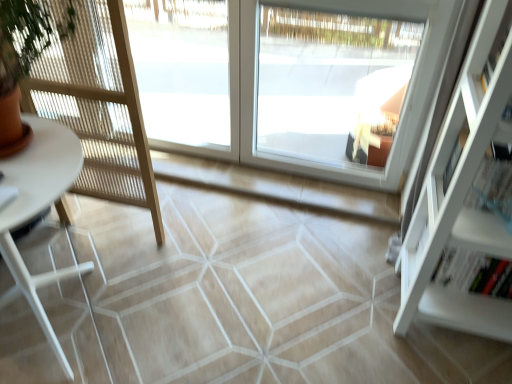
Image resolution: width=512 pixels, height=384 pixels. Identify the location of transparent glass window at center, which appears as the 3th window when viewed from the right. (183, 71).

Measure the distance between transparent glass window at center, the 1th window in the right-to-left sequence, and camera.

1.69 meters.

The width and height of the screenshot is (512, 384). Describe the element at coordinates (331, 88) in the screenshot. I see `transparent glass window at center, the 1th window in the right-to-left sequence` at that location.

Where is `transparent glass window at center, which appears as the 3th window when viewed from the right`? Image resolution: width=512 pixels, height=384 pixels. transparent glass window at center, which appears as the 3th window when viewed from the right is located at coordinates (183, 71).

Is white glass window at center, placed as the 2th window when sorted from right to left, positioned far away from white glossy table at left?

Indeed, white glass window at center, placed as the 2th window when sorted from right to left, is not near white glossy table at left.

Considering the relative positions of white glass window at center, positioned as the second window in left-to-right order, and white glossy table at left in the image provided, is white glass window at center, positioned as the second window in left-to-right order, to the right of white glossy table at left from the viewer's perspective?

Yes.

From a real-world perspective, is white glass window at center, placed as the 2th window when sorted from right to left, below white glossy table at left?

No.

Which of these two, white glass window at center, positioned as the second window in left-to-right order, or white glossy table at left, is bigger?

Bigger between the two is white glossy table at left.

From the image's perspective, which is below, white matte shelf at right or transparent glass window at center, the 1th window in the right-to-left sequence?

From the image's view, white matte shelf at right is below.

Identify the location of the 1st window to the left when counting from the white matte shelf at right. The width and height of the screenshot is (512, 384). (331, 88).

Is white matte shelf at right positioned beyond the bounds of transparent glass window at center, the 1th window in the right-to-left sequence?

white matte shelf at right lies outside transparent glass window at center, the 1th window in the right-to-left sequence,'s area.

Can you confirm if white matte shelf at right is smaller than transparent glass window at center, the 1th window in the right-to-left sequence?

Result: Actually, white matte shelf at right might be larger than transparent glass window at center, the 1th window in the right-to-left sequence.

From a real-world perspective, is transparent glass window at center, the 1th window in the right-to-left sequence, positioned above or below white glossy table at left?

Clearly, from a real-world perspective, transparent glass window at center, the 1th window in the right-to-left sequence, is above white glossy table at left.

Which object is thinner, transparent glass window at center, the 1th window in the right-to-left sequence, or white glossy table at left?

Thinner between the two is transparent glass window at center, the 1th window in the right-to-left sequence.

Is transparent glass window at center, the 1th window in the right-to-left sequence, aimed at white glossy table at left?

Yes, transparent glass window at center, the 1th window in the right-to-left sequence, faces towards white glossy table at left.

Which object is more forward, transparent glass window at center, placed as the 3th window when sorted from left to right, or white glossy table at left?

white glossy table at left.

Can you tell me how much transparent glass window at center, the 1th window in the right-to-left sequence, and transparent glass window at center, which appears as the 3th window when viewed from the right, differ in facing direction?

They differ by 0.000208 degrees in their facing directions.

Identify the location of the 2nd window directly beneath the transparent glass window at center, placed as the 3th window when sorted from left to right (from a real-world perspective). This screenshot has width=512, height=384. (183, 71).

Considering their positions, is transparent glass window at center, placed as the 3th window when sorted from left to right, located in front of or behind transparent glass window at center, placed as the 1th window when sorted from left to right?

transparent glass window at center, placed as the 3th window when sorted from left to right, is positioned closer to the viewer than transparent glass window at center, placed as the 1th window when sorted from left to right.

Considering the positions of point (306, 27) and point (233, 42), is point (306, 27) closer or farther from the camera than point (233, 42)?

Point (306, 27) appears to be farther away from the viewer than point (233, 42).

Are white matte shelf at right and white glossy table at left far apart?

Yes, white matte shelf at right is far from white glossy table at left.

Consider the image. Is white matte shelf at right oriented away from white glossy table at left?

No, white glossy table at left is not at the back of white matte shelf at right.

Between white matte shelf at right and white glossy table at left, which one has larger size?

Bigger between the two is white glossy table at left.

Which is closer to the camera, [443,128] or [0,236]?

The point [443,128] is closer to the camera.

From a real-world perspective, who is located higher, white glossy table at left or white matte shelf at right?

In real-world perspective, white matte shelf at right is above.

Is white glossy table at left next to white matte shelf at right and touching it?

No, white glossy table at left is not with white matte shelf at right.

From a real-world perspective, is white glass window at center, placed as the 2th window when sorted from right to left, located higher than transparent glass window at center, placed as the 1th window when sorted from left to right?

Yes, from a real-world perspective, white glass window at center, placed as the 2th window when sorted from right to left, is over transparent glass window at center, placed as the 1th window when sorted from left to right

Is the surface of white glass window at center, positioned as the second window in left-to-right order, in direct contact with transparent glass window at center, placed as the 1th window when sorted from left to right?

No, white glass window at center, positioned as the second window in left-to-right order, is not next to transparent glass window at center, placed as the 1th window when sorted from left to right.

Which object is further away from the camera, white glass window at center, positioned as the second window in left-to-right order, or transparent glass window at center, which appears as the 3th window when viewed from the right?

transparent glass window at center, which appears as the 3th window when viewed from the right.

Between white glass window at center, placed as the 2th window when sorted from right to left, and transparent glass window at center, placed as the 1th window when sorted from left to right, which one appears on the left side from the viewer's perspective?

transparent glass window at center, placed as the 1th window when sorted from left to right.

At what (x,y) coordinates should I click in order to perform the action: click on the 2nd window behind the white glossy table at left. Please return your answer as a coordinate pair (x, y). The image size is (512, 384). Looking at the image, I should click on (292, 81).

From the image's perspective, starting from the white matte shelf at right, which window is the 1st one above? Please provide its 2D coordinates.

[(331, 88)]

Considering their positions, is white glass window at center, placed as the 2th window when sorted from right to left, positioned closer to white matte shelf at right than transparent glass window at center, the 1th window in the right-to-left sequence?

The object closer to white matte shelf at right is transparent glass window at center, the 1th window in the right-to-left sequence.

From the image, which object appears to be farther from transparent glass window at center, which appears as the 3th window when viewed from the right, transparent glass window at center, the 1th window in the right-to-left sequence, or white matte shelf at right?

white matte shelf at right is further to transparent glass window at center, which appears as the 3th window when viewed from the right.

From the image, which object appears to be nearer to white matte shelf at right, transparent glass window at center, placed as the 1th window when sorted from left to right, or white glossy table at left?

Among the two, white glossy table at left is located nearer to white matte shelf at right.

Considering their positions, is transparent glass window at center, placed as the 1th window when sorted from left to right, positioned further to transparent glass window at center, placed as the 3th window when sorted from left to right, than white glass window at center, placed as the 2th window when sorted from right to left?

Based on the image, transparent glass window at center, placed as the 1th window when sorted from left to right, appears to be further to transparent glass window at center, placed as the 3th window when sorted from left to right.

From the image, which object appears to be nearer to white matte shelf at right, transparent glass window at center, placed as the 3th window when sorted from left to right, or white glass window at center, placed as the 2th window when sorted from right to left?

transparent glass window at center, placed as the 3th window when sorted from left to right, is positioned closer to the anchor white matte shelf at right.

Estimate the real-world distances between objects in this image. Which object is closer to white glossy table at left, transparent glass window at center, placed as the 3th window when sorted from left to right, or white glass window at center, positioned as the second window in left-to-right order?

white glass window at center, positioned as the second window in left-to-right order, is positioned closer to the anchor white glossy table at left.

From the picture: Estimate the real-world distances between objects in this image. Which object is closer to transparent glass window at center, placed as the 1th window when sorted from left to right, white matte shelf at right or transparent glass window at center, the 1th window in the right-to-left sequence?

transparent glass window at center, the 1th window in the right-to-left sequence, is closer to transparent glass window at center, placed as the 1th window when sorted from left to right.

Based on their spatial positions, is white matte shelf at right or white glass window at center, positioned as the second window in left-to-right order, further from white glossy table at left?

Among the two, white glass window at center, positioned as the second window in left-to-right order, is located further to white glossy table at left.

I want to click on window between transparent glass window at center, which appears as the 3th window when viewed from the right, and transparent glass window at center, the 1th window in the right-to-left sequence, in the horizontal direction, so click(x=292, y=81).

The width and height of the screenshot is (512, 384). In order to click on window between white matte shelf at right and white glass window at center, placed as the 2th window when sorted from right to left, along the z-axis in this screenshot , I will do `click(331, 88)`.